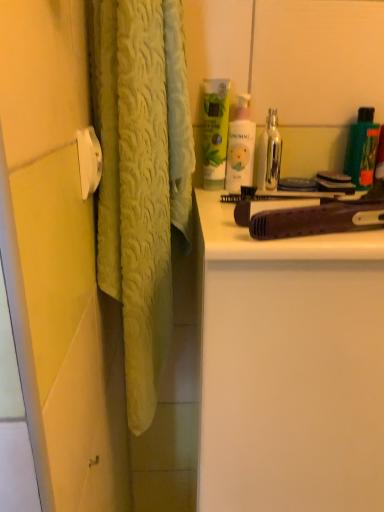
Question: Is the position of white matte cabinet at right less distant than that of green matte lotion at upper center?

Choices:
 (A) yes
 (B) no

Answer: (A)

Question: Is white matte cabinet at right shorter than green matte lotion at upper center?

Choices:
 (A) yes
 (B) no

Answer: (B)

Question: Is white matte cabinet at right turned away from green matte lotion at upper center?

Choices:
 (A) no
 (B) yes

Answer: (A)

Question: Can you confirm if white matte cabinet at right is taller than green matte lotion at upper center?

Choices:
 (A) yes
 (B) no

Answer: (A)

Question: Does white matte cabinet at right have a greater width compared to green matte lotion at upper center?

Choices:
 (A) no
 (B) yes

Answer: (B)

Question: Considering the positions of point (334, 241) and point (266, 158), is point (334, 241) closer or farther from the camera than point (266, 158)?

Choices:
 (A) farther
 (B) closer

Answer: (B)

Question: Relative to metallic silver mouthwash at upper right, marked as the 2th mouthwash in a right-to-left arrangement, is brown wood comb at upper right in front or behind?

Choices:
 (A) front
 (B) behind

Answer: (A)

Question: Considering the relative positions of brown wood comb at upper right and metallic silver mouthwash at upper right, marked as the 2th mouthwash in a right-to-left arrangement, in the image provided, is brown wood comb at upper right to the left or to the right of metallic silver mouthwash at upper right, marked as the 2th mouthwash in a right-to-left arrangement,?

Choices:
 (A) left
 (B) right

Answer: (B)

Question: Choose the correct answer: Is brown wood comb at upper right inside metallic silver mouthwash at upper right, arranged as the 1th mouthwash when viewed from the left, or outside it?

Choices:
 (A) inside
 (B) outside

Answer: (B)

Question: In the image, is green matte bottle at upper right, which ranks as the 2th mouthwash in left-to-right order, on the left side or the right side of green matte lotion at upper center?

Choices:
 (A) right
 (B) left

Answer: (A)

Question: Considering the positions of point (367, 120) and point (205, 155), is point (367, 120) closer or farther from the camera than point (205, 155)?

Choices:
 (A) closer
 (B) farther

Answer: (A)

Question: Relative to green matte lotion at upper center, is green matte bottle at upper right, the first mouthwash when ordered from right to left, in front or behind?

Choices:
 (A) behind
 (B) front

Answer: (A)

Question: From the image's perspective, relative to green matte lotion at upper center, is green matte bottle at upper right, the first mouthwash when ordered from right to left, above or below?

Choices:
 (A) above
 (B) below

Answer: (B)

Question: Is pink matte lotion at upper center, which ranks as the second toiletry in right-to-left order, inside or outside of green matte lotion at upper center?

Choices:
 (A) outside
 (B) inside

Answer: (A)

Question: Considering their positions, is pink matte lotion at upper center, which ranks as the second toiletry in right-to-left order, located in front of or behind green matte lotion at upper center?

Choices:
 (A) behind
 (B) front

Answer: (A)